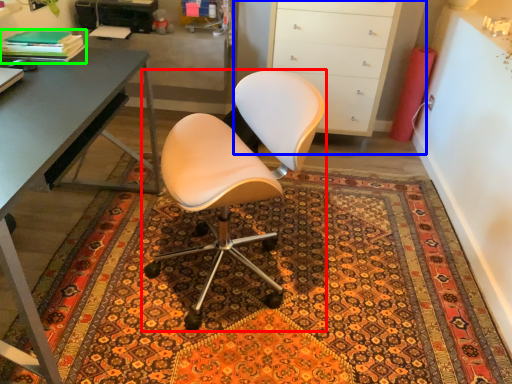
Question: Considering the real-world distances, which object is farthest from chair (highlighted by a red box)? cabinetry (highlighted by a blue box) or book (highlighted by a green box)?

Choices:
 (A) cabinetry
 (B) book

Answer: (A)